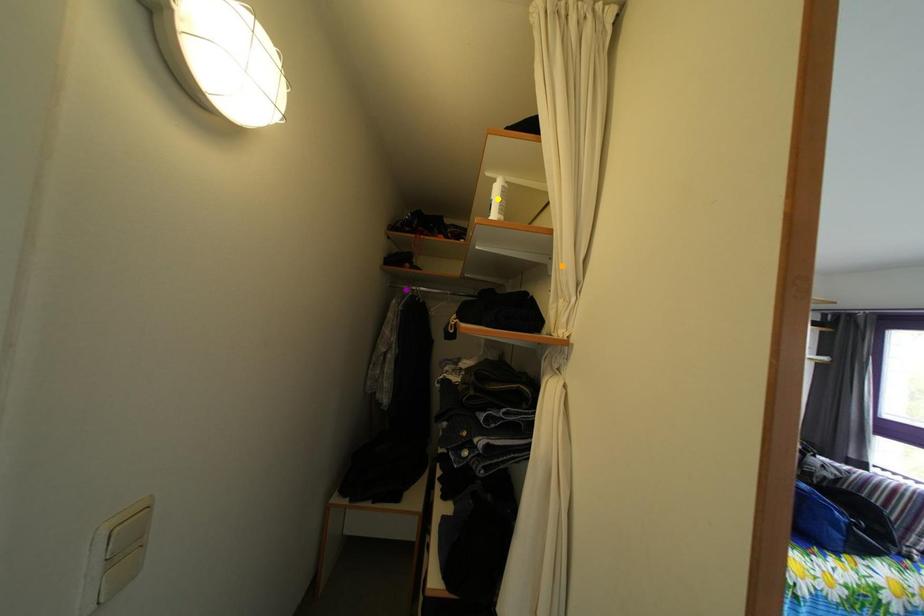
Order these from nearest to farthest:
- purple point
- orange point
- yellow point

purple point < yellow point < orange point